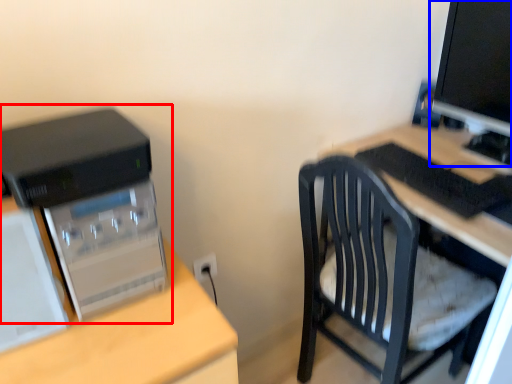
Question: Which object is further to the camera taking this photo, computer tower (highlighted by a red box) or computer monitor (highlighted by a blue box)?

Choices:
 (A) computer tower
 (B) computer monitor

Answer: (B)